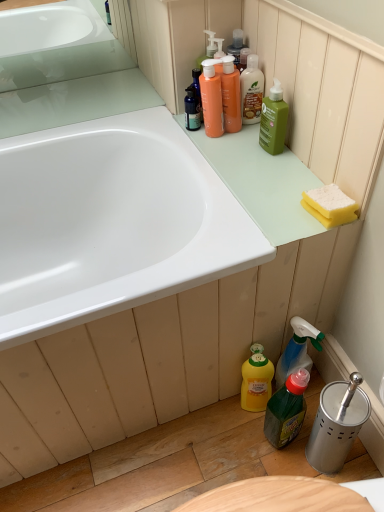
Question: Is translucent plastic mouthwash at upper center taller than translucent green bottle at lower center?

Choices:
 (A) yes
 (B) no

Answer: (B)

Question: Can you confirm if translucent plastic mouthwash at upper center is thinner than translucent green bottle at lower center?

Choices:
 (A) yes
 (B) no

Answer: (A)

Question: Can translucent green bottle at lower center be found inside translucent plastic mouthwash at upper center?

Choices:
 (A) no
 (B) yes

Answer: (A)

Question: Is translucent plastic mouthwash at upper center at the right side of translucent green bottle at lower center?

Choices:
 (A) no
 (B) yes

Answer: (A)

Question: Can you confirm if translucent plastic mouthwash at upper center is wider than translucent green bottle at lower center?

Choices:
 (A) no
 (B) yes

Answer: (A)

Question: Would you say translucent plastic bottle at upper center, positioned as the 5th cleaning product in bottom-to-top order, is to the left or to the right of yellow sponge at upper right in the picture?

Choices:
 (A) left
 (B) right

Answer: (A)

Question: In terms of height, does translucent plastic bottle at upper center, which appears as the first cleaning product when viewed from the top, look taller or shorter compared to yellow sponge at upper right?

Choices:
 (A) tall
 (B) short

Answer: (A)

Question: From the image's perspective, relative to yellow sponge at upper right, is translucent plastic bottle at upper center, which appears as the first cleaning product when viewed from the top, above or below?

Choices:
 (A) above
 (B) below

Answer: (A)

Question: From a real-world perspective, relative to yellow sponge at upper right, is translucent plastic bottle at upper center, positioned as the 5th cleaning product in bottom-to-top order, vertically above or below?

Choices:
 (A) above
 (B) below

Answer: (A)

Question: From the image's perspective, is yellow matte bottle at lower center, positioned as the 1th cleaning product in bottom-to-top order, positioned above or below translucent plastic mouthwash at upper center?

Choices:
 (A) above
 (B) below

Answer: (B)

Question: Is yellow matte bottle at lower center, the fifth cleaning product in the top-to-bottom sequence, bigger or smaller than translucent plastic mouthwash at upper center?

Choices:
 (A) small
 (B) big

Answer: (B)

Question: Does point (264, 358) appear closer or farther from the camera than point (238, 96)?

Choices:
 (A) closer
 (B) farther

Answer: (A)

Question: In terms of height, does yellow matte bottle at lower center, the fifth cleaning product in the top-to-bottom sequence, look taller or shorter compared to translucent plastic mouthwash at upper center?

Choices:
 (A) tall
 (B) short

Answer: (A)

Question: From a real-world perspective, relative to translucent plastic bottle at upper center, positioned as the 5th cleaning product in bottom-to-top order, is matte orange pump bottles at upper center, the fourth cleaning product positioned from the bottom, vertically above or below?

Choices:
 (A) below
 (B) above

Answer: (B)

Question: Looking at their shapes, would you say matte orange pump bottles at upper center, which is the second cleaning product from top to bottom, is wider or thinner than translucent plastic bottle at upper center, positioned as the 5th cleaning product in bottom-to-top order?

Choices:
 (A) wide
 (B) thin

Answer: (A)